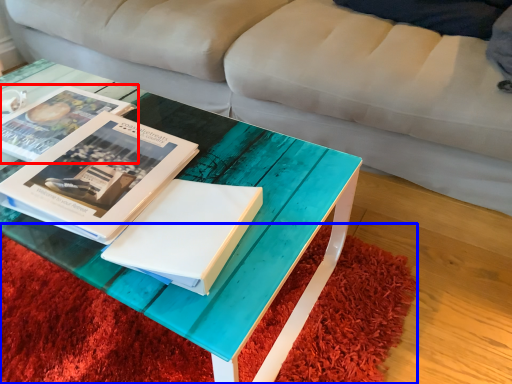
Question: Which object appears closest to the camera in this image, book (highlighted by a red box) or mat (highlighted by a blue box)?

Choices:
 (A) book
 (B) mat

Answer: (B)